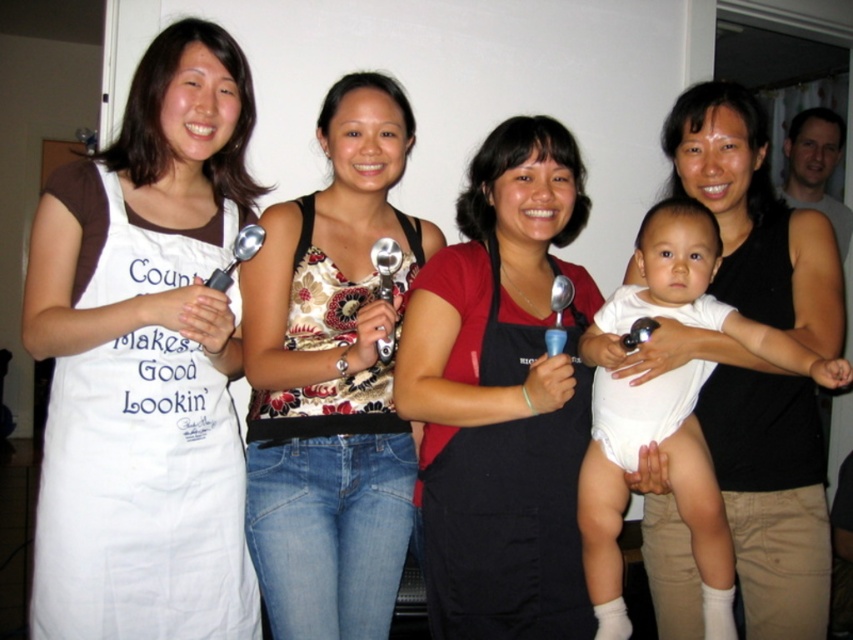
Question: Observing the image, what is the correct spatial positioning of floral fabric tank top at center in reference to white cotton apron at left?

Choices:
 (A) above
 (B) below

Answer: (A)

Question: Which point is farther to the camera?

Choices:
 (A) click(x=71, y=388)
 (B) click(x=683, y=452)
 (C) click(x=370, y=83)

Answer: (C)

Question: Does floral fabric tank top at center have a larger size compared to black matte apron at center?

Choices:
 (A) no
 (B) yes

Answer: (B)

Question: Considering the real-world distances, which object is closest to the floral fabric tank top at center?

Choices:
 (A) white cloth diaper at center
 (B) black matte apron at center

Answer: (B)

Question: Which of these objects is positioned closest to the white cloth diaper at center?

Choices:
 (A) white cotton apron at left
 (B) floral fabric tank top at center

Answer: (B)

Question: Can you confirm if white cotton apron at left is smaller than black matte apron at center?

Choices:
 (A) yes
 (B) no

Answer: (B)